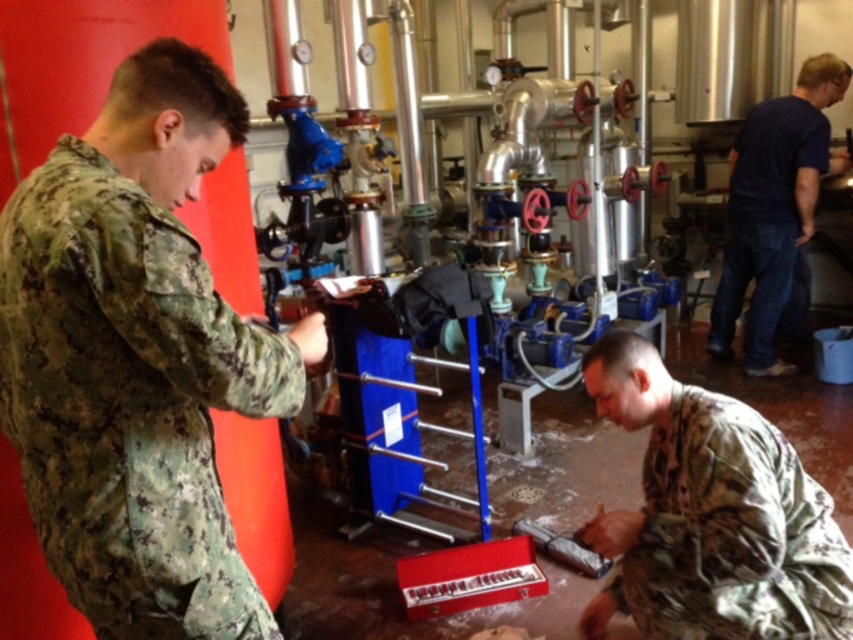
Question: Among these objects, which one is nearest to the camera?

Choices:
 (A) camouflage fabric uniform at left
 (B) camouflage fabric uniform at lower right

Answer: (A)

Question: Which point is farther from the camera taking this photo?

Choices:
 (A) (602, 621)
 (B) (119, 497)
 (C) (752, 316)

Answer: (C)

Question: Does camouflage fabric uniform at lower right come behind dark blue shirt at right?

Choices:
 (A) no
 (B) yes

Answer: (A)

Question: Can you confirm if camouflage fabric uniform at left is wider than camouflage fabric uniform at lower right?

Choices:
 (A) yes
 (B) no

Answer: (B)

Question: Which object is the closest to the camouflage fabric uniform at lower right?

Choices:
 (A) camouflage fabric uniform at left
 (B) dark blue shirt at right

Answer: (A)

Question: Observing the image, what is the correct spatial positioning of camouflage fabric uniform at left in reference to dark blue shirt at right?

Choices:
 (A) left
 (B) right

Answer: (A)